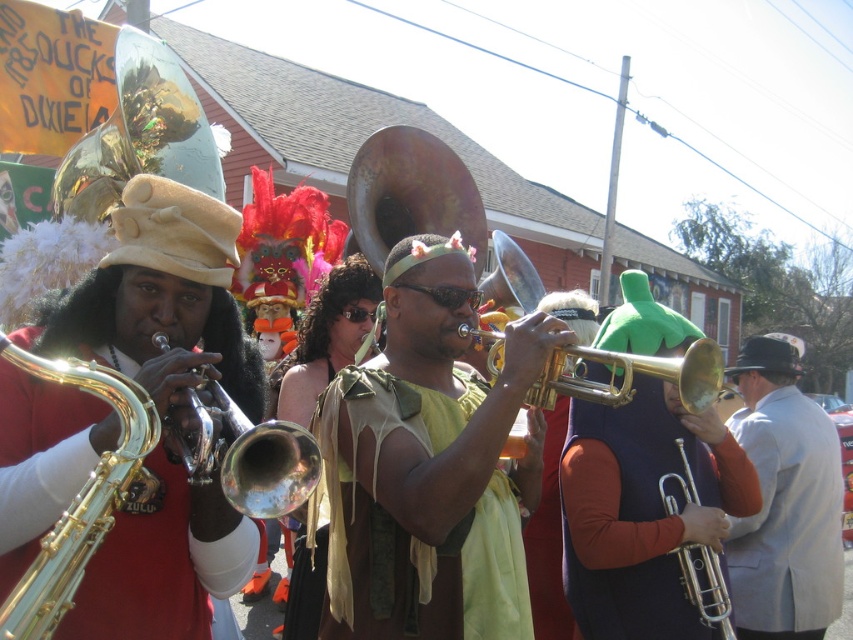
Question: Which of the following is the closest to the observer?

Choices:
 (A) (743, 497)
 (B) (20, 360)
 (C) (715, 577)

Answer: (B)

Question: Can you confirm if gray wool suit at right is thinner than gold shiny trumpet at center?

Choices:
 (A) no
 (B) yes

Answer: (B)

Question: Which of the following is the closest to the observer?

Choices:
 (A) (0, 637)
 (B) (778, 624)
 (C) (190, 262)
 (D) (727, 632)

Answer: (A)

Question: Which point appears closest to the camera in this image?

Choices:
 (A) (148, 568)
 (B) (451, 412)

Answer: (A)

Question: Where is velvet green vest at center located in relation to silver metallic trumpet at lower right in the image?

Choices:
 (A) below
 (B) above

Answer: (B)

Question: From the image, what is the correct spatial relationship of gold fabric with fringe at center in relation to gold shiny trumpet at left?

Choices:
 (A) above
 (B) below

Answer: (B)